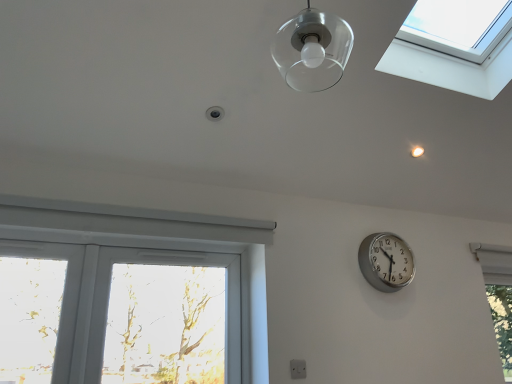
Question: Should I look upward or downward to see white plastic window at lower left?

Choices:
 (A) up
 (B) down

Answer: (B)

Question: Would you say transparent glass window at upper right, the 1th window positioned from the left, is outside white plastic window at lower left?

Choices:
 (A) yes
 (B) no

Answer: (A)

Question: Is the position of transparent glass window at upper right, which is the 2th window in bottom-to-top order, less distant than that of white plastic window at lower left?

Choices:
 (A) no
 (B) yes

Answer: (B)

Question: Is transparent glass window at upper right, placed as the second window when sorted from back to front, positioned with its back to white plastic window at lower left?

Choices:
 (A) yes
 (B) no

Answer: (B)

Question: Does transparent glass window at upper right, the 1th window positioned from the left, have a greater width compared to white plastic window at lower left?

Choices:
 (A) no
 (B) yes

Answer: (B)

Question: From the image's perspective, is transparent glass window at upper right, placed as the second window when sorted from back to front, located above white plastic window at lower left?

Choices:
 (A) yes
 (B) no

Answer: (A)

Question: From a real-world perspective, is transparent glass window at upper right, the first window when ordered from front to back, under white plastic window at lower left?

Choices:
 (A) no
 (B) yes

Answer: (A)

Question: From a real-world perspective, does clear glass lampshade at upper center sit lower than silver metallic clock at right?

Choices:
 (A) yes
 (B) no

Answer: (B)

Question: Is there a large distance between clear glass lampshade at upper center and silver metallic clock at right?

Choices:
 (A) yes
 (B) no

Answer: (A)

Question: Does clear glass lampshade at upper center have a greater height compared to silver metallic clock at right?

Choices:
 (A) yes
 (B) no

Answer: (B)

Question: Is silver metallic clock at right completely or partially inside clear glass lampshade at upper center?

Choices:
 (A) no
 (B) yes

Answer: (A)

Question: Can you confirm if clear glass lampshade at upper center is shorter than silver metallic clock at right?

Choices:
 (A) no
 (B) yes

Answer: (B)

Question: Is clear glass lampshade at upper center to the left of silver metallic clock at right from the viewer's perspective?

Choices:
 (A) no
 (B) yes

Answer: (B)

Question: Is transparent glass droplight at upper center surrounded by transparent glass window at upper right, the first window when ordered from front to back?

Choices:
 (A) no
 (B) yes

Answer: (A)